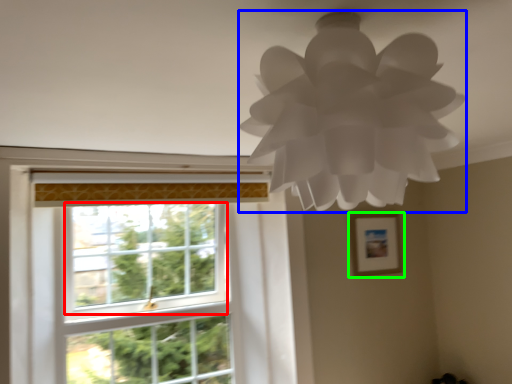
Question: Which is nearer to the window screen (highlighted by a red box)? lamp (highlighted by a blue box) or picture frame (highlighted by a green box).

Choices:
 (A) lamp
 (B) picture frame

Answer: (B)